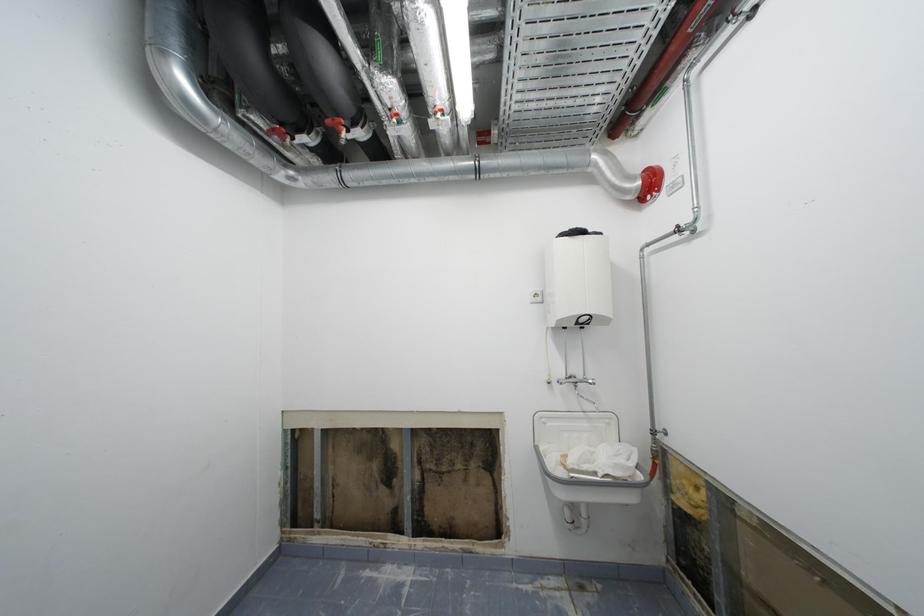
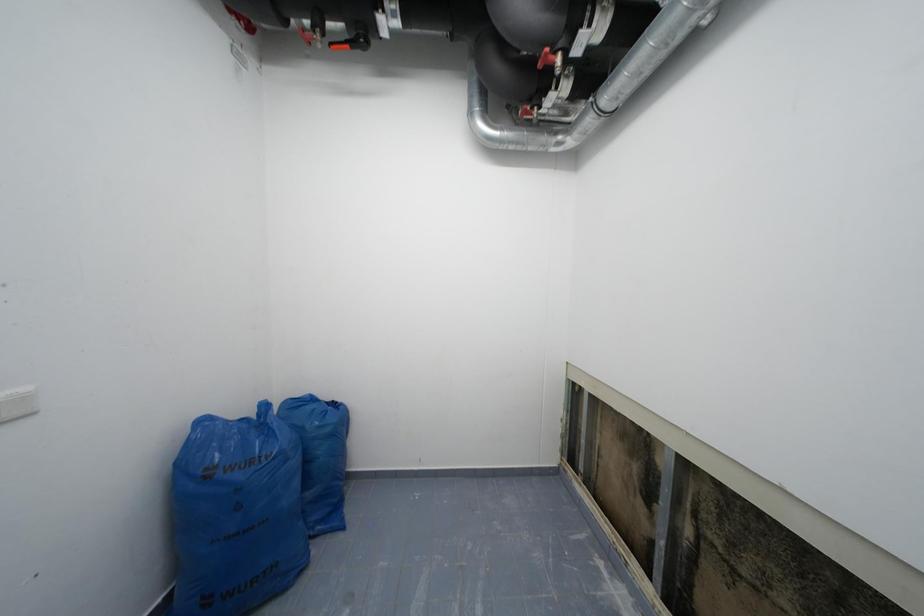
Question: How did the camera likely rotate?

Choices:
 (A) Left
 (B) Right
 (C) Up
 (D) Down

Answer: (A)